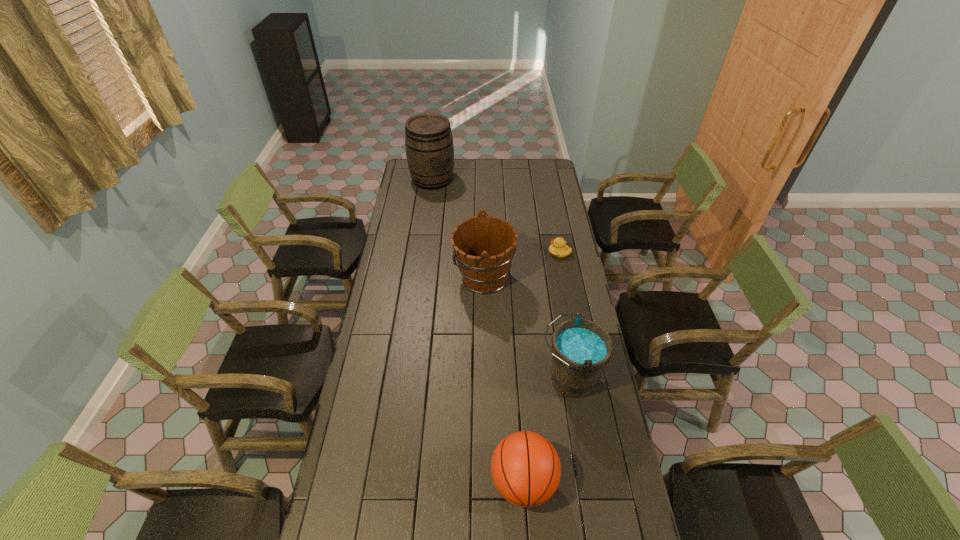
The width and height of the screenshot is (960, 540). I want to click on the leftmost object, so click(x=429, y=146).

In order to click on the farthest object in this screenshot , I will do `click(429, 146)`.

In order to click on the second wine bucket from left to right in this screenshot , I will do `click(484, 247)`.

Identify the location of the nearest wine bucket. (581, 349).

At what (x,y) coordinates should I click in order to perform the action: click on the rightmost wine bucket. Please return your answer as a coordinate pair (x, y). The image size is (960, 540). Looking at the image, I should click on (581, 349).

Where is `the nearest object`? Image resolution: width=960 pixels, height=540 pixels. the nearest object is located at coordinates (525, 467).

Find the location of a particular element. The height and width of the screenshot is (540, 960). basketball is located at coordinates (525, 467).

What are the coordinates of `the shortest object` in the screenshot? It's located at (558, 248).

Identify the location of vacant position located on the right of the leftmost object. This screenshot has width=960, height=540. (510, 179).

The height and width of the screenshot is (540, 960). Identify the location of free location located 0.250m with the handle on the second wine bucket from left to right. (398, 278).